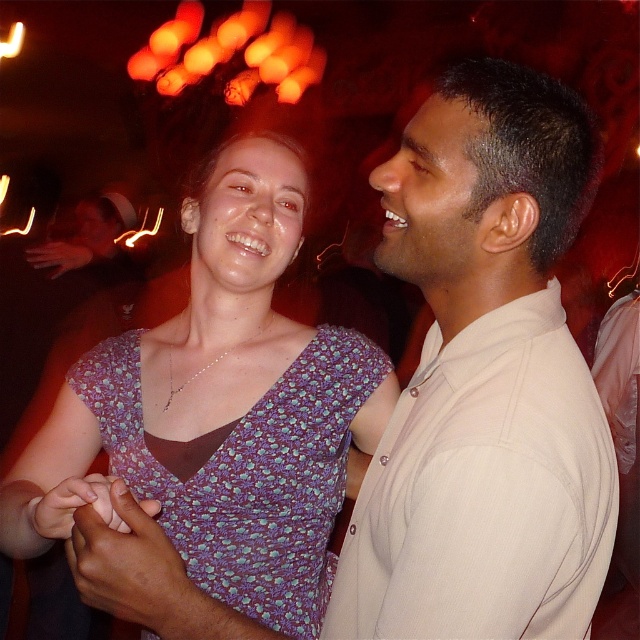
Does white smooth shirt at right have a smaller size compared to purple floral fabric dress at center?

Correct, white smooth shirt at right occupies less space than purple floral fabric dress at center.

Does white smooth shirt at right appear over purple floral fabric dress at center?

Correct, white smooth shirt at right is located above purple floral fabric dress at center.

Does point (397, 536) come in front of point (330, 556)?

Yes, point (397, 536) is in front of point (330, 556).

You are a GUI agent. You are given a task and a screenshot of the screen. Output one action in this format:
    pyautogui.click(x=<x>, y=<y>)
    Task: Click on the white smooth shirt at right
    
    Given the screenshot: What is the action you would take?
    tap(484, 380)